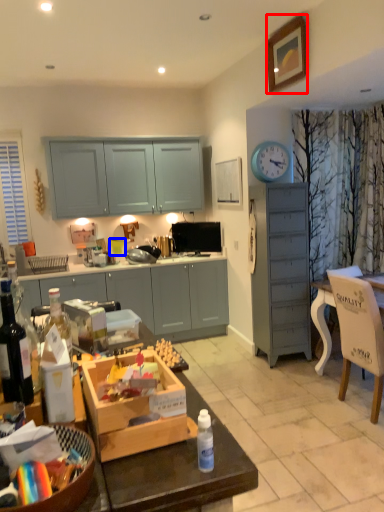
Question: Among these objects, which one is nearest to the camera, picture frame (highlighted by a red box) or coffee cup (highlighted by a blue box)?

Choices:
 (A) picture frame
 (B) coffee cup

Answer: (A)